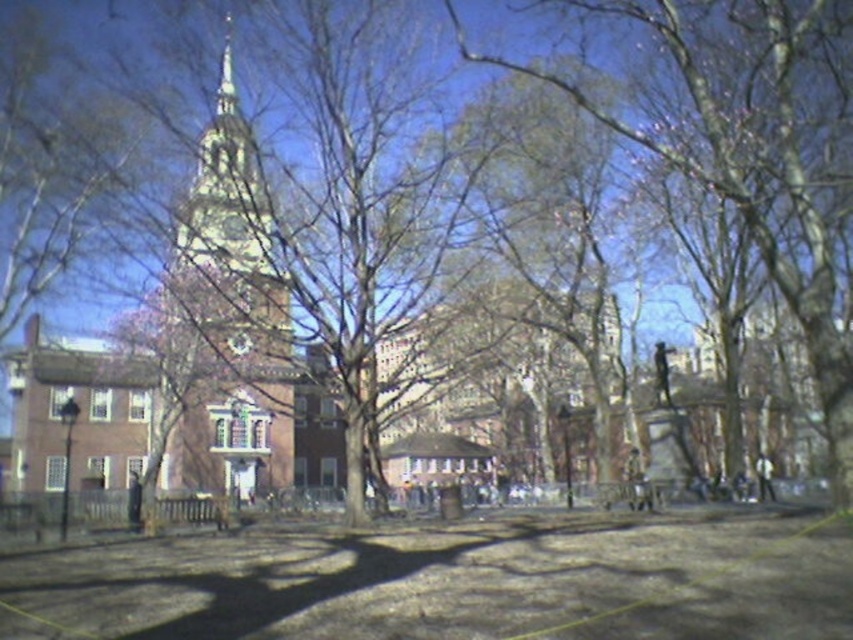
Who is shorter, brown brick tower at center or shiny silver spire at upper center?

With less height is shiny silver spire at upper center.

Is brown brick tower at center further to camera compared to shiny silver spire at upper center?

No, brown brick tower at center is in front of shiny silver spire at upper center.

Is point (248, 275) farther from viewer compared to point (230, 97)?

No, it is not.

Where is `brown brick tower at center`? The image size is (853, 640). brown brick tower at center is located at coordinates (228, 323).